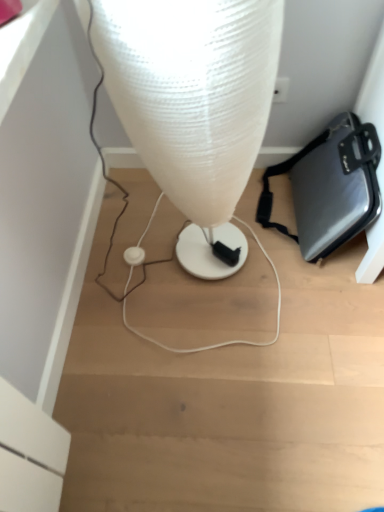
Question: Does white plastic earphone at center have a smaller size compared to metallic gray briefcase at lower right?

Choices:
 (A) yes
 (B) no

Answer: (A)

Question: From a real-world perspective, does white plastic earphone at center sit lower than metallic gray briefcase at lower right?

Choices:
 (A) no
 (B) yes

Answer: (B)

Question: Can you confirm if white plastic earphone at center is taller than metallic gray briefcase at lower right?

Choices:
 (A) no
 (B) yes

Answer: (A)

Question: Is white plastic earphone at center facing towards metallic gray briefcase at lower right?

Choices:
 (A) no
 (B) yes

Answer: (A)

Question: Considering the relative positions of white plastic earphone at center and metallic gray briefcase at lower right in the image provided, is white plastic earphone at center to the right of metallic gray briefcase at lower right from the viewer's perspective?

Choices:
 (A) no
 (B) yes

Answer: (A)

Question: From the image's perspective, is white plastic earphone at center over metallic gray briefcase at lower right?

Choices:
 (A) yes
 (B) no

Answer: (B)

Question: Is metallic gray briefcase at lower right shorter than white plastic earphone at center?

Choices:
 (A) yes
 (B) no

Answer: (B)

Question: Can you confirm if metallic gray briefcase at lower right is wider than white plastic earphone at center?

Choices:
 (A) yes
 (B) no

Answer: (A)

Question: Considering the relative positions of metallic gray briefcase at lower right and white plastic earphone at center in the image provided, is metallic gray briefcase at lower right to the left of white plastic earphone at center from the viewer's perspective?

Choices:
 (A) no
 (B) yes

Answer: (A)

Question: Would you say metallic gray briefcase at lower right contains white plastic earphone at center?

Choices:
 (A) no
 (B) yes

Answer: (A)

Question: From a real-world perspective, is metallic gray briefcase at lower right under white plastic earphone at center?

Choices:
 (A) yes
 (B) no

Answer: (B)

Question: Considering the relative sizes of metallic gray briefcase at lower right and white plastic earphone at center in the image provided, is metallic gray briefcase at lower right thinner than white plastic earphone at center?

Choices:
 (A) yes
 (B) no

Answer: (B)

Question: Does translucent plastic lamp at center have a larger size compared to white plastic earphone at center?

Choices:
 (A) no
 (B) yes

Answer: (B)